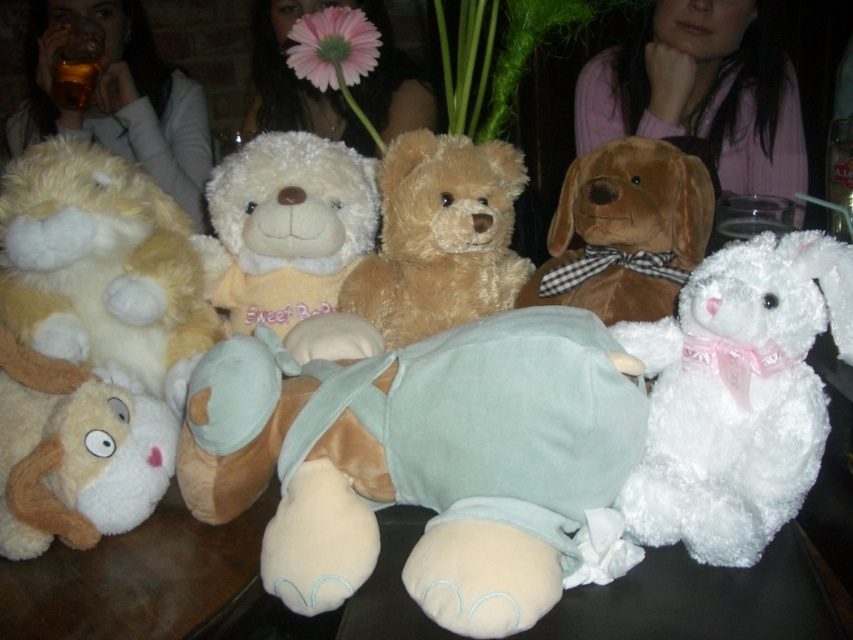
Which of these two, fluffy beige teddy bear at left or brown plush dog at center, stands taller?

With more height is fluffy beige teddy bear at left.

Can you confirm if fluffy beige teddy bear at left is positioned below brown plush dog at center?

Correct, fluffy beige teddy bear at left is located below brown plush dog at center.

Is point (160, 244) closer to viewer compared to point (647, 237)?

That is False.

I want to click on fluffy beige teddy bear at left, so click(x=102, y=268).

Does fluffy beige teddy bear at left have a lesser height compared to white plush teddy bear at center?

No.

Does point (100, 200) come closer to viewer compared to point (318, 273)?

Yes.

Locate an element on the screen. The width and height of the screenshot is (853, 640). fluffy beige teddy bear at left is located at coordinates (102, 268).

This screenshot has width=853, height=640. I want to click on fluffy beige teddy bear at left, so click(102, 268).

Which is in front, point (62, 365) or point (396, 248)?

Point (62, 365) is more forward.

Based on the photo, between fluffy beige dog at lower left and fuzzy brown teddy bear at center, which one appears on the left side from the viewer's perspective?

fluffy beige dog at lower left

Which is behind, point (55, 449) or point (415, 248)?

The point (415, 248) is more distant.

What are the coordinates of `fluffy beige dog at lower left` in the screenshot? It's located at (74, 452).